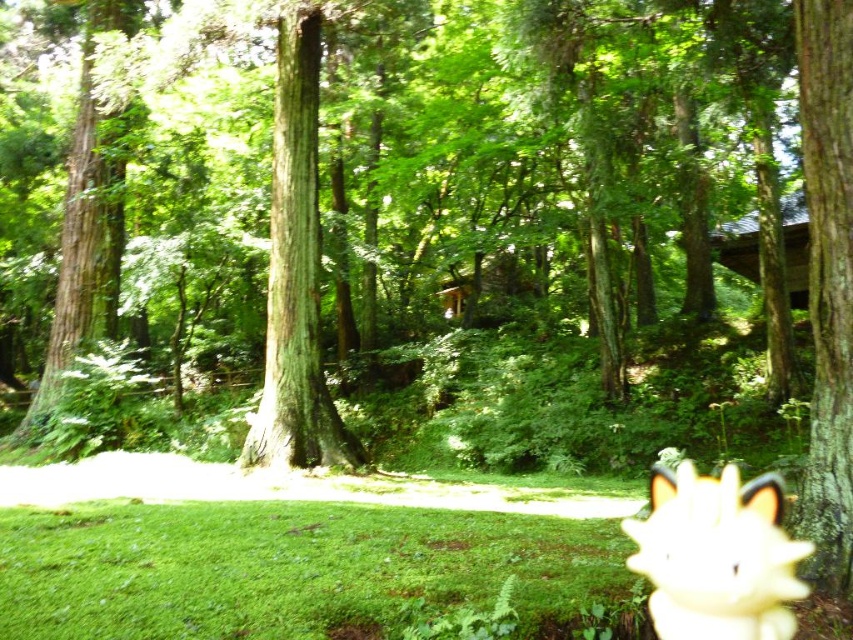
Who is positioned more to the left, green rough bark tree at right or white fluffy dog at lower right?

white fluffy dog at lower right is more to the left.

Is green rough bark tree at right above white fluffy dog at lower right?

Yes, green rough bark tree at right is above white fluffy dog at lower right.

Is point (822, 272) closer to camera compared to point (688, 520)?

No.

In order to click on green rough bark tree at right in this screenshot , I will do `click(827, 282)`.